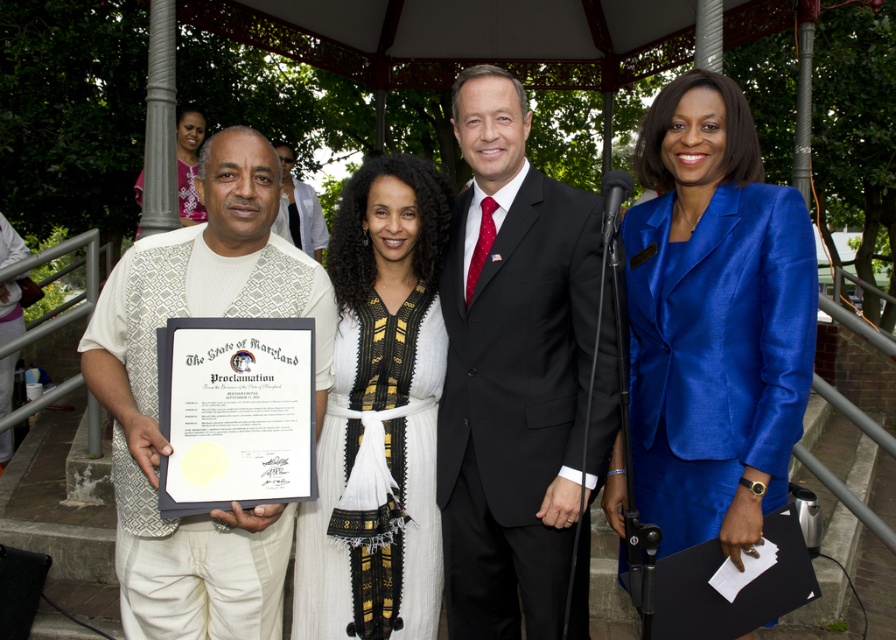
Question: In this image, where is blue silk suit at center located relative to pink floral dress at upper left?

Choices:
 (A) below
 (B) above

Answer: (A)

Question: Is black suit at center smaller than matte white shirt at center?

Choices:
 (A) no
 (B) yes

Answer: (B)

Question: Among these points, which one is nearest to the camera?

Choices:
 (A) (192, 179)
 (B) (513, 358)

Answer: (B)

Question: Among these objects, which one is farthest from the camera?

Choices:
 (A) white textured fabric at left
 (B) white woven dress at center
 (C) blue silk suit at center
 (D) matte white shirt at center

Answer: (D)

Question: Which object is the closest to the black suit at center?

Choices:
 (A) blue silk suit at center
 (B) white textured fabric at left

Answer: (A)

Question: From the image, what is the correct spatial relationship of white woven dress at center in relation to pink floral dress at upper left?

Choices:
 (A) above
 (B) below

Answer: (B)